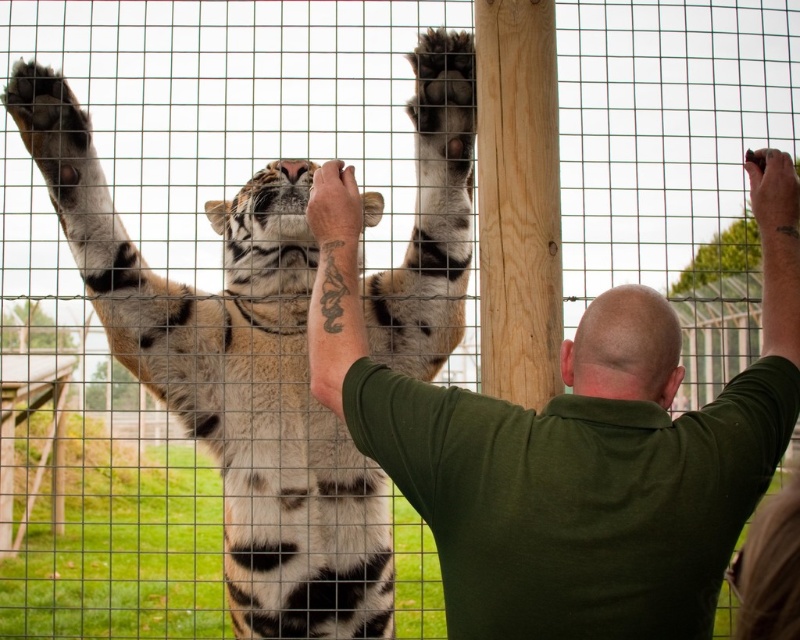
Does green matte shirt at center appear under orange-brown fur tiger at center?

Yes.

Who is more forward, (604, 445) or (254, 413)?

Point (604, 445) is in front.

Image resolution: width=800 pixels, height=640 pixels. I want to click on green matte shirt at center, so click(x=574, y=445).